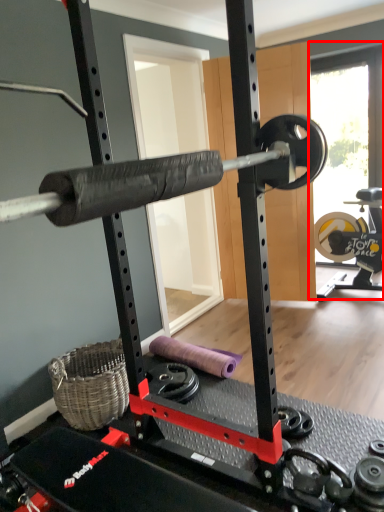
Question: Where is window screen (annotated by the red box) located in relation to dumbbell in the image?

Choices:
 (A) right
 (B) left

Answer: (A)